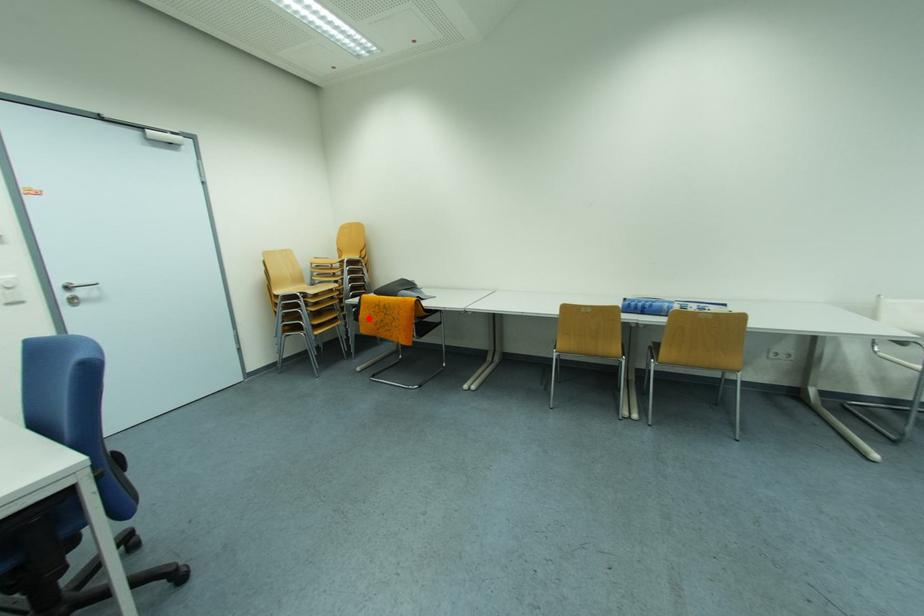
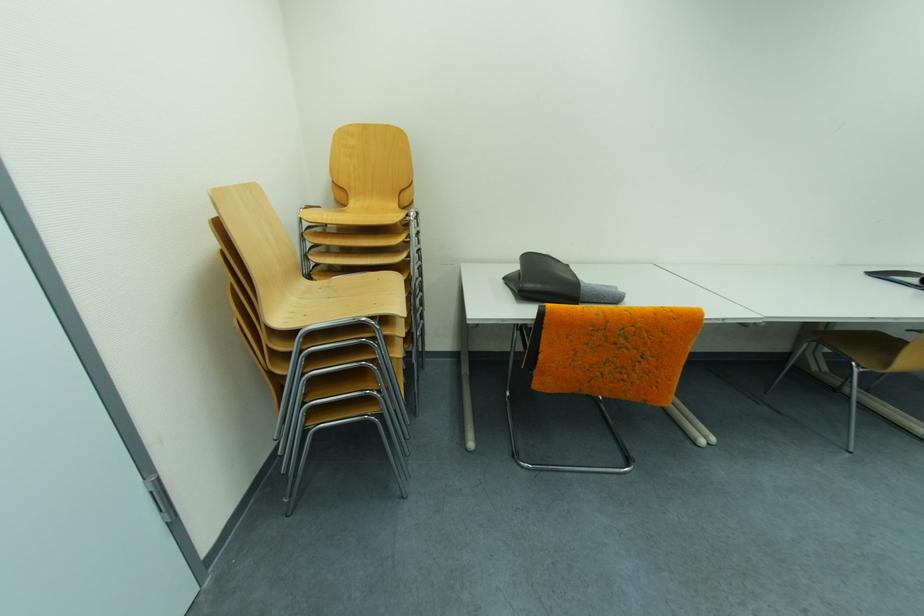
Where in the second image is the point corresponding to the highlighted location from the first image?

(549, 359)